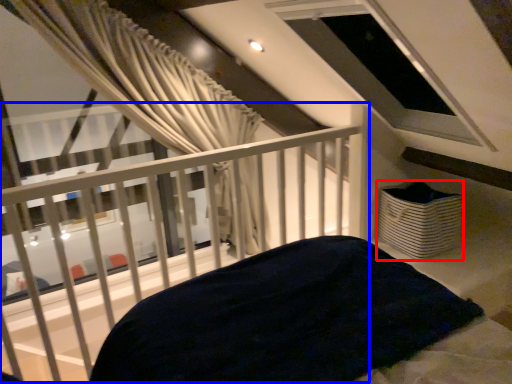
Question: Which object appears farthest to the camera in this image, basket (highlighted by a red box) or balcony (highlighted by a blue box)?

Choices:
 (A) basket
 (B) balcony

Answer: (A)